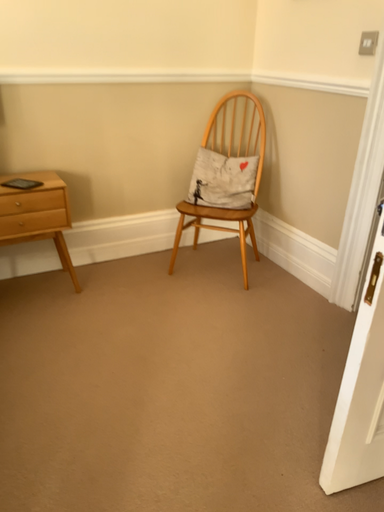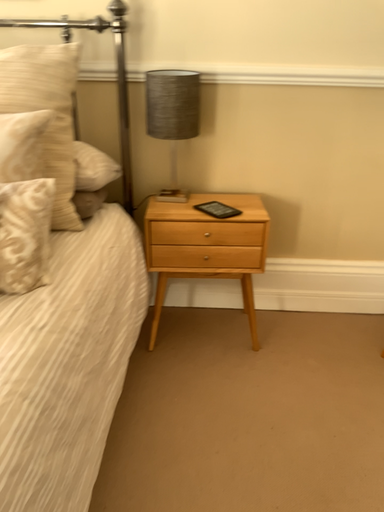
Question: Which way did the camera rotate in the video?

Choices:
 (A) rotated right
 (B) rotated left

Answer: (B)